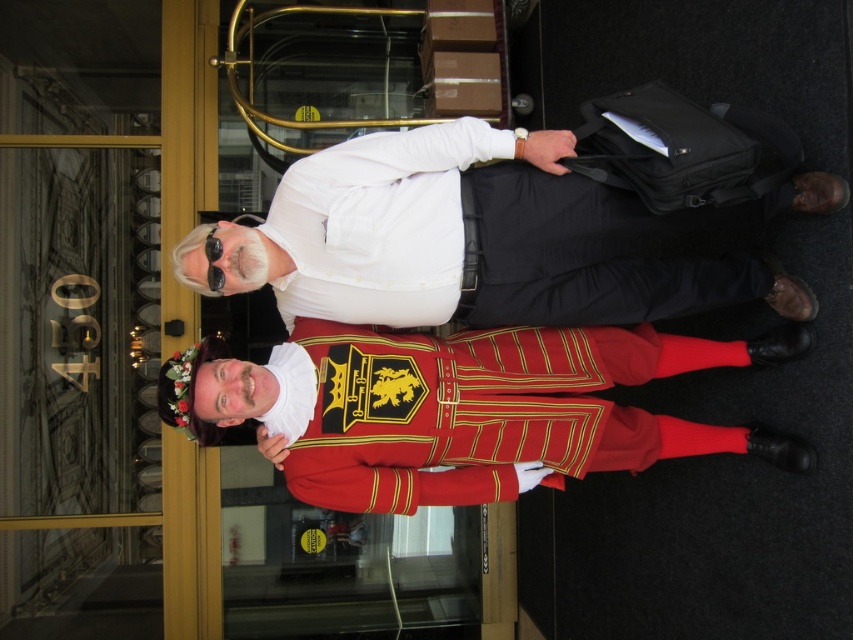
Question: Where is white matte shirt at upper center located in relation to shiny red uniform at center in the image?

Choices:
 (A) left
 (B) right

Answer: (B)

Question: Does white matte shirt at upper center come behind shiny red uniform at center?

Choices:
 (A) no
 (B) yes

Answer: (A)

Question: Among these objects, which one is farthest from the camera?

Choices:
 (A) white matte shirt at upper center
 (B) shiny red uniform at center

Answer: (B)

Question: Can you confirm if white matte shirt at upper center is wider than shiny red uniform at center?

Choices:
 (A) no
 (B) yes

Answer: (A)

Question: Which of the following is the farthest from the observer?

Choices:
 (A) (352, 353)
 (B) (370, 150)

Answer: (A)